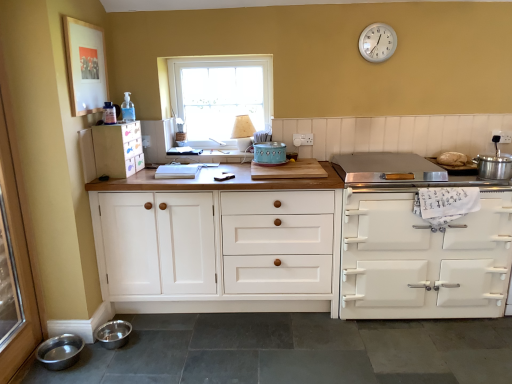
Identify the location of free point below silver metallic bowl at lower left, which is the 2th bowl from left to right (from a real-world perspective). This screenshot has height=384, width=512. (116, 337).